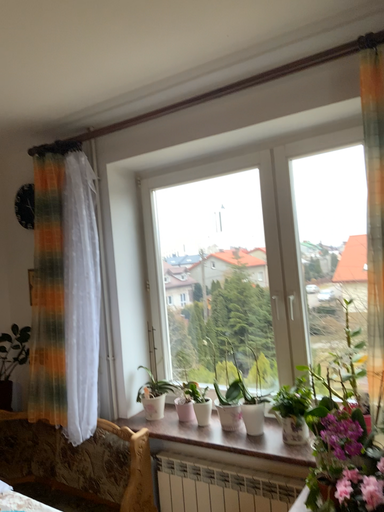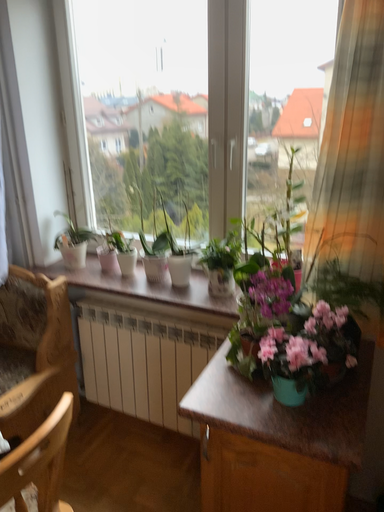
Question: Which way did the camera rotate in the video?

Choices:
 (A) rotated left
 (B) rotated right

Answer: (B)